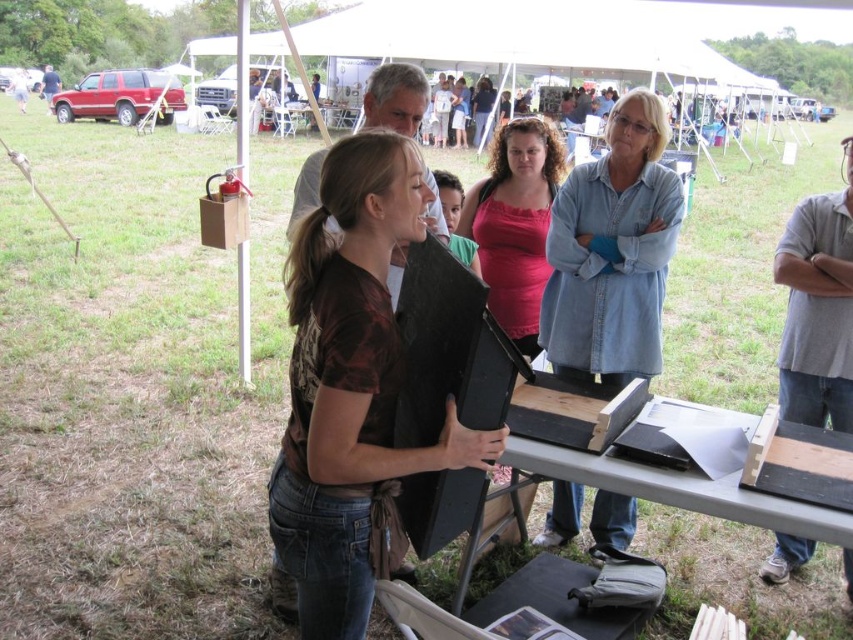
Who is positioned more to the left, denim shirt at upper center or wooden table at center?

wooden table at center

Is denim shirt at upper center in front of wooden table at center?

That is True.

You are a GUI agent. You are given a task and a screenshot of the screen. Output one action in this format:
    pyautogui.click(x=<x>, y=<y>)
    Task: Click on the denim shirt at upper center
    
    Given the screenshot: What is the action you would take?
    pyautogui.click(x=612, y=252)

Is brown textured shirt at center wider than wooden table at center?

In fact, brown textured shirt at center might be narrower than wooden table at center.

Is point (373, 154) closer to camera compared to point (323, 128)?

That is True.

Where is `brown textured shirt at center`? This screenshot has height=640, width=853. brown textured shirt at center is located at coordinates [351, 385].

Is point (654, 179) positioned after point (558, 477)?

That is True.

Does denim shirt at upper center have a larger size compared to wooden picnic table at center?

Actually, denim shirt at upper center might be smaller than wooden picnic table at center.

Between point (555, 298) and point (524, 458), which one is positioned behind?

Positioned behind is point (555, 298).

Locate an element on the screen. denim shirt at upper center is located at coordinates (612, 252).